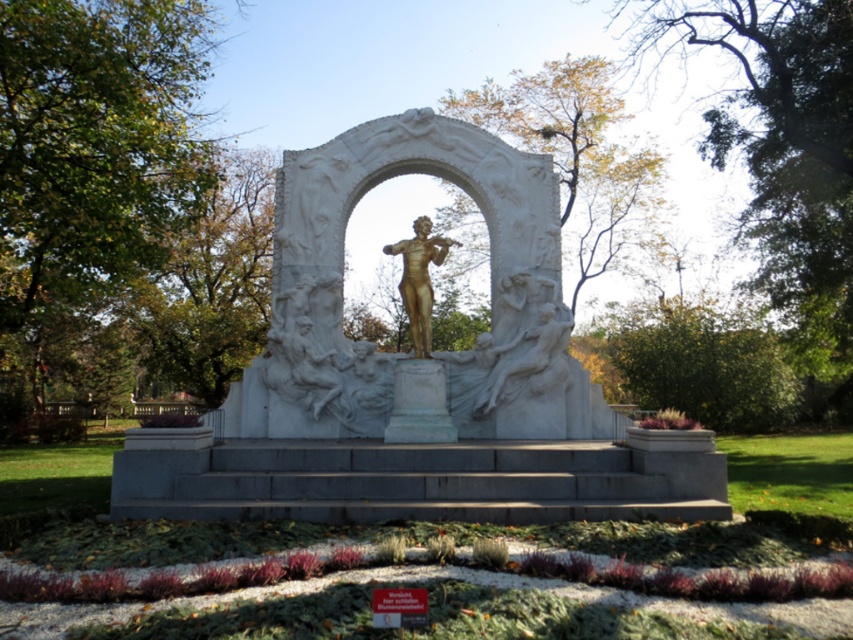
Question: Which of the following is the farthest from the observer?

Choices:
 (A) gold statue at center
 (B) white marble statue at center

Answer: (A)

Question: Does white marble statue at center appear on the right side of gold polished statue at center?

Choices:
 (A) no
 (B) yes

Answer: (A)

Question: Which object is positioned farthest from the gold polished statue at center?

Choices:
 (A) white marble statue at center
 (B) gold statue at center

Answer: (B)

Question: Is white marble statue at center wider than gold statue at center?

Choices:
 (A) no
 (B) yes

Answer: (B)

Question: Does white marble statue at center appear over gold statue at center?

Choices:
 (A) no
 (B) yes

Answer: (A)

Question: Which object appears farthest from the camera in this image?

Choices:
 (A) gold statue at center
 (B) gold polished statue at center

Answer: (A)